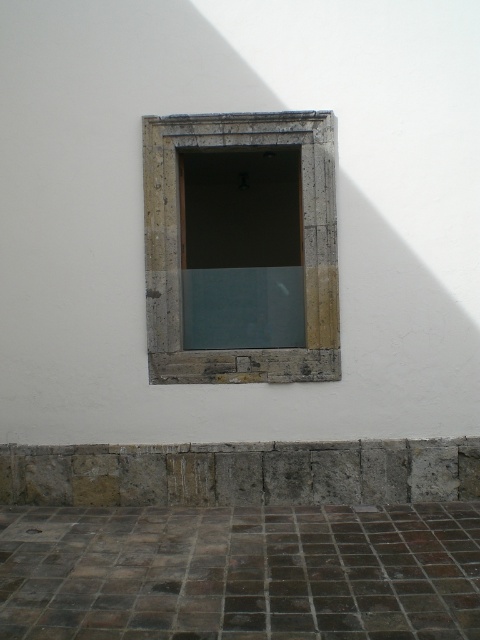
How much distance is there between stone/rough concrete ledge at lower center and stone/rough textured window frame at center?

The distance of stone/rough concrete ledge at lower center from stone/rough textured window frame at center is 3.66 feet.

Between point (324, 502) and point (325, 360), which one is positioned in front?

Point (325, 360)

Find the location of a particular element. The image size is (480, 640). stone/rough concrete ledge at lower center is located at coordinates (241, 472).